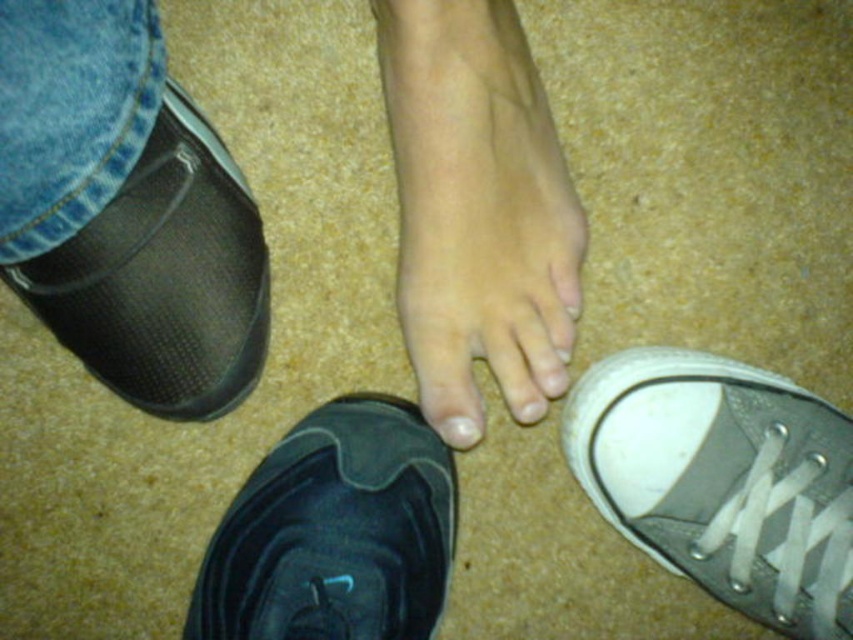
Does gray canvas shoe at lower right appear over black suede shoe at center?

Yes, gray canvas shoe at lower right is above black suede shoe at center.

How much distance is there between gray canvas shoe at lower right and black suede shoe at center?

gray canvas shoe at lower right is 9.62 inches away from black suede shoe at center.

Which is behind, point (811, 541) or point (444, 593)?

The point (444, 593) is more distant.

Find the location of a particular element. gray canvas shoe at lower right is located at coordinates (722, 481).

Find the location of `gray canvas shoe at lower right`. gray canvas shoe at lower right is located at coordinates (722, 481).

Which of these two, gray canvas shoe at lower right or white matte nail at center, stands shorter?

white matte nail at center

Is point (851, 541) less distant than point (445, 442)?

Yes, point (851, 541) is in front of point (445, 442).

Find the location of a particular element. gray canvas shoe at lower right is located at coordinates (722, 481).

Does matte black shoe at lower center have a smaller size compared to white matte nail at center?

Incorrect, matte black shoe at lower center is not smaller in size than white matte nail at center.

The height and width of the screenshot is (640, 853). I want to click on matte black shoe at lower center, so click(x=477, y=204).